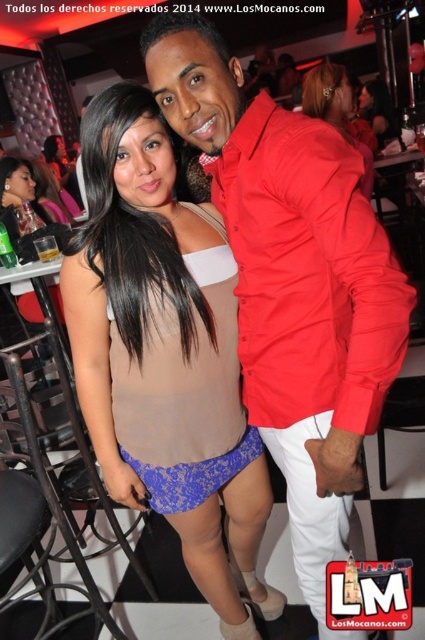
Who is shorter, sheer beige fabric at center or matte beige lingerie at center?

matte beige lingerie at center

Where is `sheer beige fabric at center`? sheer beige fabric at center is located at coordinates (184, 388).

What do you see at coordinates (164, 355) in the screenshot? I see `matte beige top at center` at bounding box center [164, 355].

Measure the distance between matte beige top at center and camera.

matte beige top at center and camera are 3.80 feet apart.

What are the coordinates of `matte beige top at center` in the screenshot? It's located at (164, 355).

Based on the photo, who is more forward, (x=280, y=380) or (x=255, y=444)?

Positioned in front is point (x=280, y=380).

Measure the distance from matte red shirt at center to sheer beige fabric at center.

matte red shirt at center and sheer beige fabric at center are 23.63 centimeters apart from each other.

This screenshot has height=640, width=425. What do you see at coordinates (292, 282) in the screenshot? I see `matte red shirt at center` at bounding box center [292, 282].

Where is `matte red shirt at center`? matte red shirt at center is located at coordinates (292, 282).